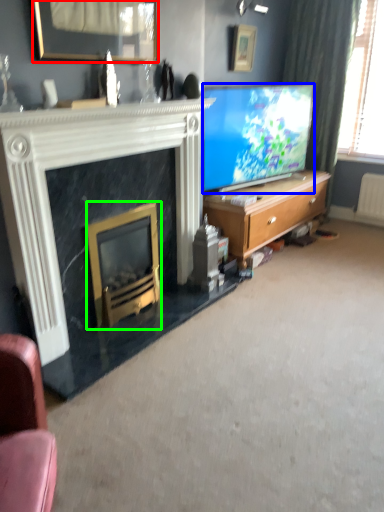
Question: Considering the real-world distances, which object is farthest from picture frame (highlighted by a red box)? television (highlighted by a blue box) or fireplace (highlighted by a green box)?

Choices:
 (A) television
 (B) fireplace

Answer: (A)